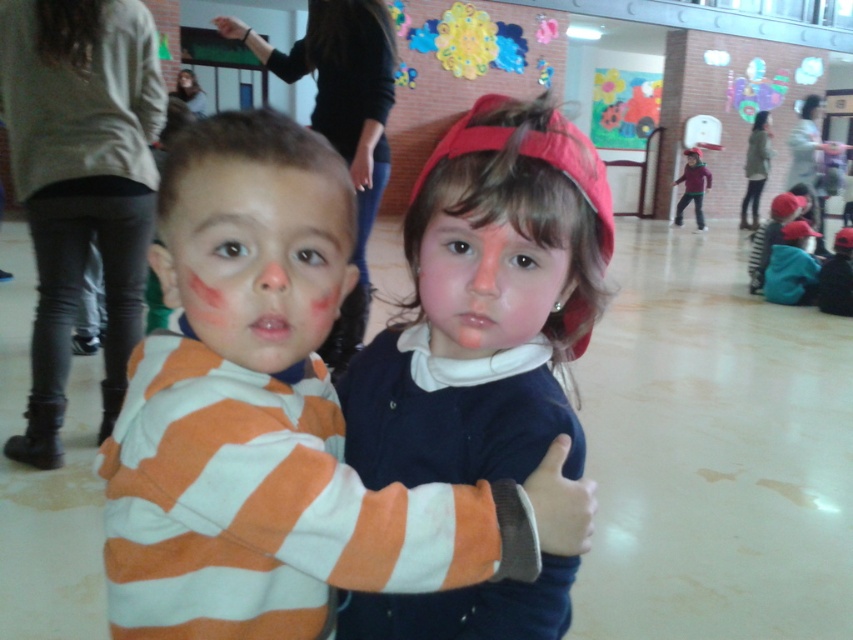
Question: Among these objects, which one is farthest from the camera?

Choices:
 (A) smooth skin face at center
 (B) orange striped sweater at center

Answer: (A)

Question: Is the position of matte orange striped shirt at center less distant than that of smooth skin face at center?

Choices:
 (A) no
 (B) yes

Answer: (B)

Question: Which object is farther from the camera taking this photo?

Choices:
 (A) orange striped sweater at center
 (B) matte purple sweater at center
 (C) matte blue sweater at center

Answer: (B)

Question: Can you confirm if orange striped sweater at center is positioned below matte purple sweater at center?

Choices:
 (A) no
 (B) yes

Answer: (B)

Question: Is orange striped sweater at center thinner than matte orange striped shirt at center?

Choices:
 (A) no
 (B) yes

Answer: (A)

Question: Estimate the real-world distances between objects in this image. Which object is closer to the smooth skin face at center?

Choices:
 (A) matte purple sweater at center
 (B) matte orange striped shirt at center

Answer: (B)